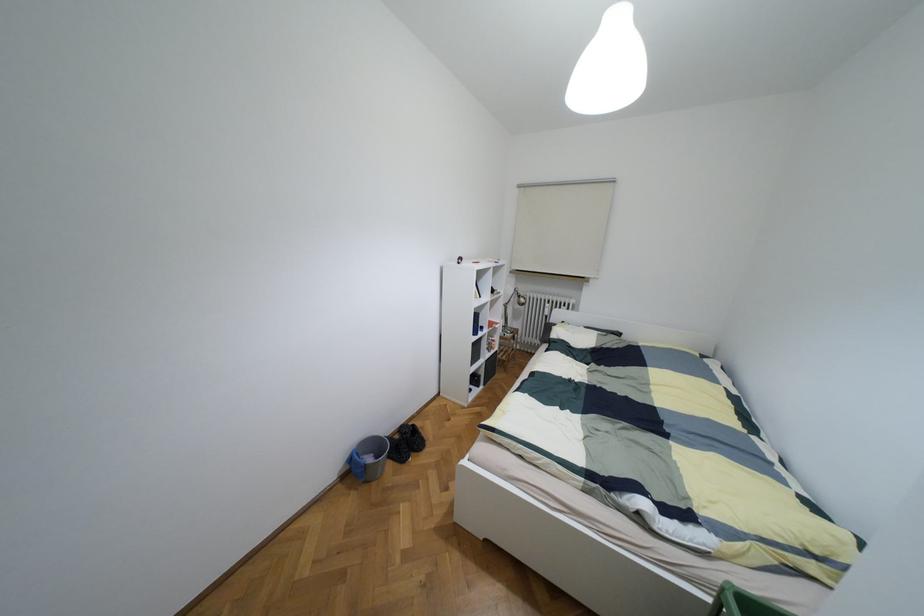
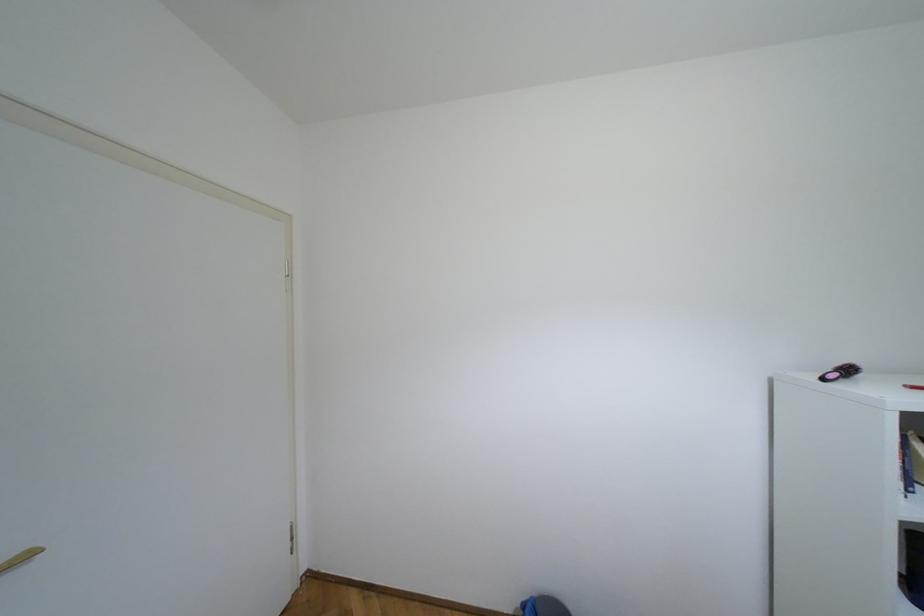
Question: How did the camera likely rotate?

Choices:
 (A) Left
 (B) Right
 (C) Up
 (D) Down

Answer: (A)